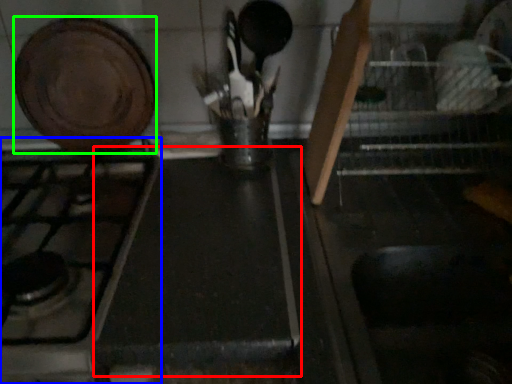
Question: Which object is positioned farthest from counter top (highlighted by a red box)? Select from gas stove (highlighted by a blue box) and kitchen appliance (highlighted by a green box).

Choices:
 (A) gas stove
 (B) kitchen appliance

Answer: (B)